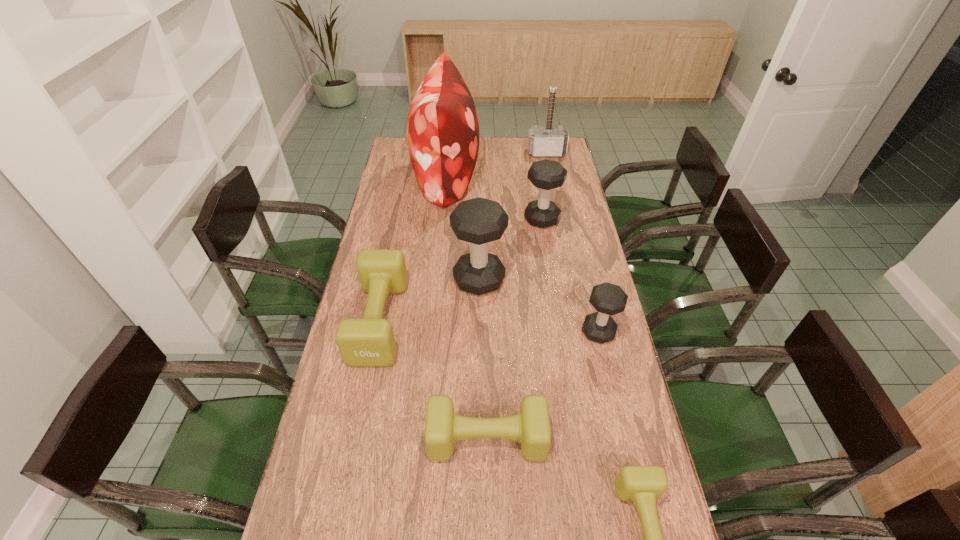
In order to click on the tallest object in this screenshot , I will do `click(442, 129)`.

The image size is (960, 540). Identify the location of red cushion. (442, 129).

The width and height of the screenshot is (960, 540). What are the coordinates of `hammer` in the screenshot? It's located at (543, 141).

At what (x,y) coordinates should I click in order to perform the action: click on the biggest gray dumbbell. Please return your answer as a coordinate pair (x, y). Looking at the image, I should click on (478, 221).

At what (x,y) coordinates should I click in order to perform the action: click on the second nearest gray dumbbell. Please return your answer as a coordinate pair (x, y). Looking at the image, I should click on (478, 221).

The width and height of the screenshot is (960, 540). I want to click on the second biggest gray dumbbell, so click(x=546, y=174).

Where is `the farthest gray dumbbell`? Image resolution: width=960 pixels, height=540 pixels. the farthest gray dumbbell is located at coordinates (546, 174).

This screenshot has width=960, height=540. Identify the location of the smallest gray dumbbell. (608, 299).

What are the coordinates of `the biggest olive dumbbell` in the screenshot? It's located at (369, 341).

Where is `the third shortest dumbbell`? Image resolution: width=960 pixels, height=540 pixels. the third shortest dumbbell is located at coordinates (369, 341).